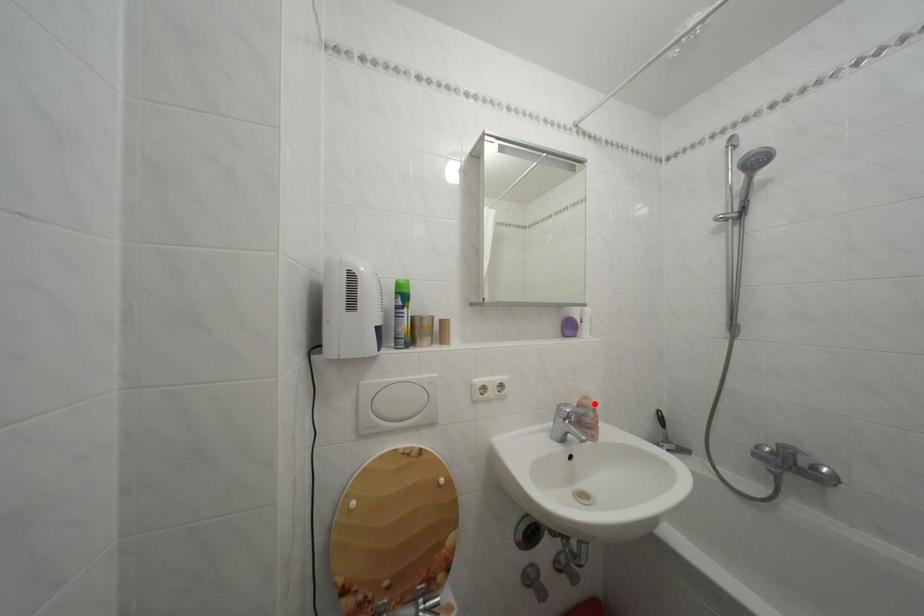
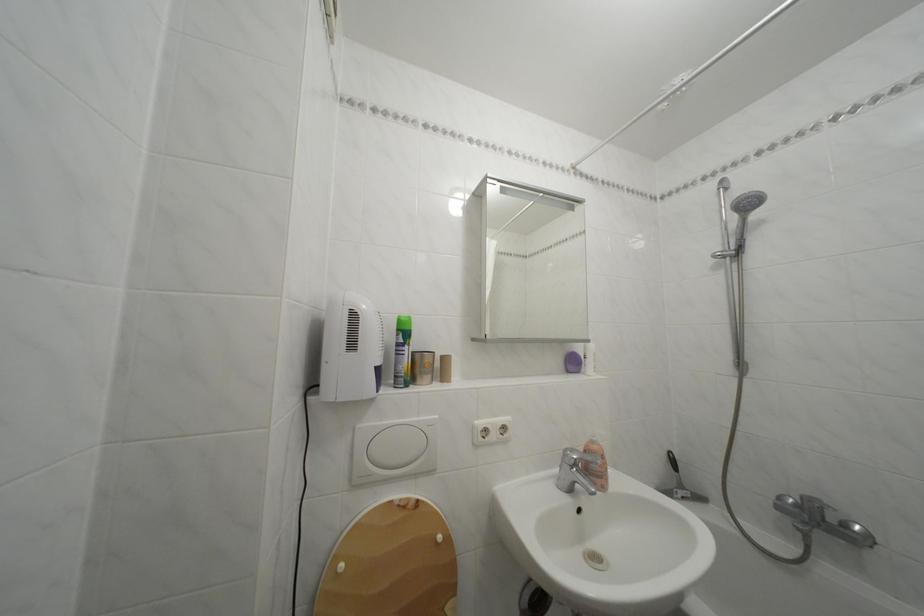
Question: I am providing you with two images of the same scene from different viewpoints. Image1 has a red point marked. In image2, the corresponding 3D location appears at what relative position? Reply with the corresponding letter.

Choices:
 (A) Closer
 (B) Farther

Answer: (A)